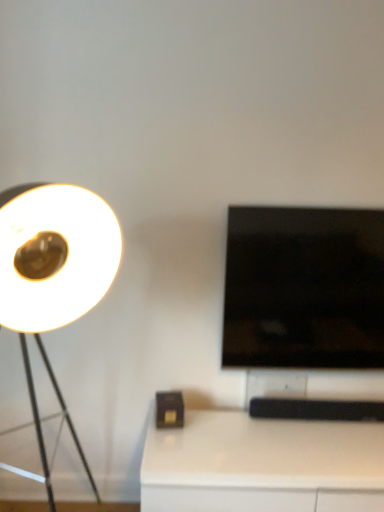
Question: Is white matte lamp at left completely or partially outside of white glossy table at lower right?

Choices:
 (A) yes
 (B) no

Answer: (A)

Question: Is white matte lamp at left to the left of white glossy table at lower right from the viewer's perspective?

Choices:
 (A) yes
 (B) no

Answer: (A)

Question: Is white matte lamp at left further to camera compared to white glossy table at lower right?

Choices:
 (A) no
 (B) yes

Answer: (A)

Question: From a real-world perspective, is white matte lamp at left physically above white glossy table at lower right?

Choices:
 (A) yes
 (B) no

Answer: (A)

Question: Can you confirm if white matte lamp at left is smaller than white glossy table at lower right?

Choices:
 (A) yes
 (B) no

Answer: (B)

Question: Considering the positions of white matte lamp at left and white glossy table at lower right in the image, is white matte lamp at left bigger or smaller than white glossy table at lower right?

Choices:
 (A) small
 (B) big

Answer: (B)

Question: From the image's perspective, is white matte lamp at left positioned above or below white glossy table at lower right?

Choices:
 (A) below
 (B) above

Answer: (B)

Question: Is white matte lamp at left spatially inside white glossy table at lower right, or outside of it?

Choices:
 (A) outside
 (B) inside

Answer: (A)

Question: Is white matte lamp at left to the left or to the right of white glossy table at lower right in the image?

Choices:
 (A) right
 (B) left

Answer: (B)

Question: Do you think black glossy tv at right is within white glossy table at lower right, or outside of it?

Choices:
 (A) outside
 (B) inside

Answer: (A)

Question: From a real-world perspective, is black glossy tv at right positioned above or below white glossy table at lower right?

Choices:
 (A) below
 (B) above

Answer: (B)

Question: Is point (352, 231) closer or farther from the camera than point (263, 443)?

Choices:
 (A) farther
 (B) closer

Answer: (A)

Question: Is black glossy tv at right in front of or behind white glossy table at lower right in the image?

Choices:
 (A) behind
 (B) front

Answer: (A)

Question: Choose the correct answer: Is black glossy tv at right inside white matte lamp at left or outside it?

Choices:
 (A) outside
 (B) inside

Answer: (A)

Question: From a real-world perspective, is black glossy tv at right above or below white matte lamp at left?

Choices:
 (A) above
 (B) below

Answer: (A)